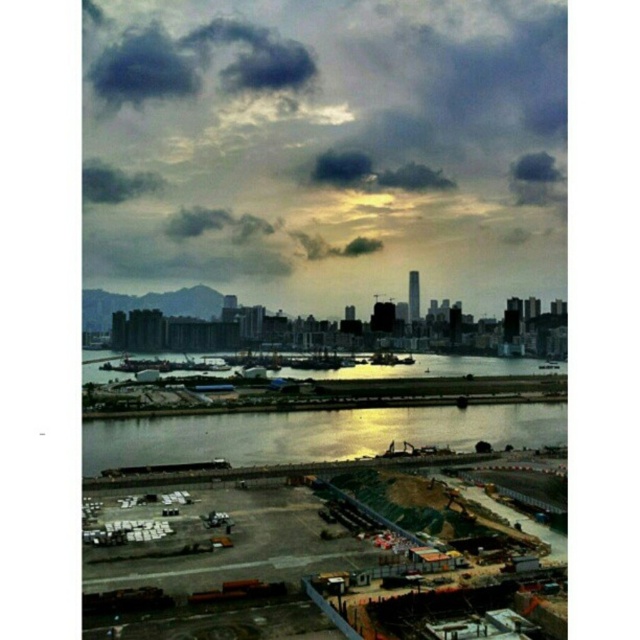
You are standing at the center of the cityscape and want to reach the reflective glass waterway at center. Which direction should you move to reach it?

The reflective glass waterway at center is located at point (314, 435), so you should move towards the center of the cityscape to reach it.

Looking at this image, you are a drone operator tasked with capturing aerial footage of the cityscape. Your drone has a maximum flight range of 1 meter. If you are positioned at the dark gray cloud at upper center, can you fly your drone to the reflective glass waterway at center without exceeding its range?

The distance between the dark gray cloud at upper center and the reflective glass waterway at center is 72.50 centimeters, which is within the drone operator s 1 meter range. Therefore, the drone can safely fly from the dark gray cloud at upper center to the reflective glass waterway at center without exceeding its maximum flight range.

You are standing in the cityscape and want to take a photo of the dark gray cloud at upper center. If your camera can focus on objects up to 3 meters away, will it be able to capture the cloud clearly?

The dark gray cloud at upper center is 2.66 meters away from the camera, which is within the camera focus range of 3 meters. Therefore, the camera can capture the cloud clearly.